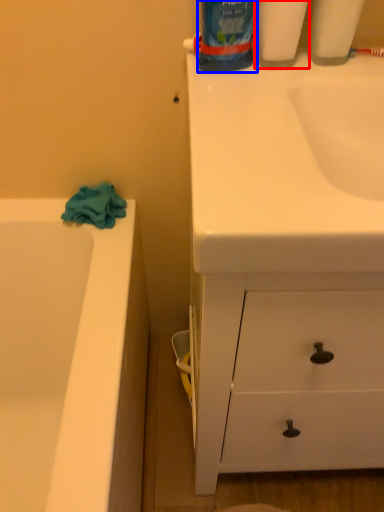
Question: Which object is closer to the camera taking this photo, cleaning product (highlighted by a red box) or cleaning product (highlighted by a blue box)?

Choices:
 (A) cleaning product
 (B) cleaning product

Answer: (B)